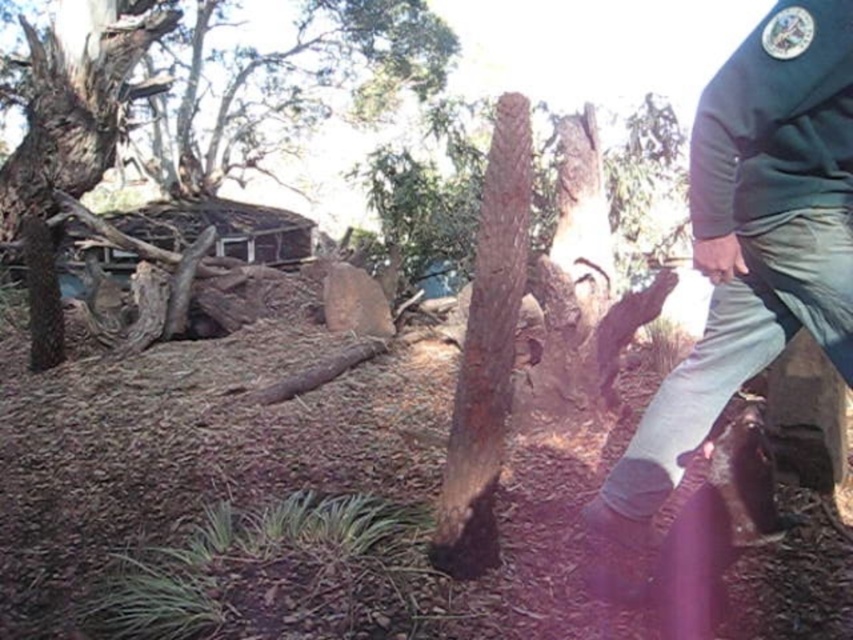
Which is below, dark green uniform at center or dark brown rough bark tree at left?

dark green uniform at center is lower down.

Can you confirm if dark green uniform at center is positioned below dark brown rough bark tree at left?

Correct, dark green uniform at center is located below dark brown rough bark tree at left.

Is point (776, 298) positioned in front of point (47, 172)?

Yes, point (776, 298) is in front of point (47, 172).

Where is `dark green uniform at center`? This screenshot has height=640, width=853. dark green uniform at center is located at coordinates (747, 253).

At what (x,y) coordinates should I click in order to perform the action: click on dark brown rough bark tree at left. Please return your answer as a coordinate pair (x, y). The height and width of the screenshot is (640, 853). Looking at the image, I should click on (71, 134).

Is dark brown rough bark tree at left in front of brown rough bark tree trunk at center?

No, dark brown rough bark tree at left is behind brown rough bark tree trunk at center.

Between point (120, 81) and point (459, 410), which one is positioned in front?

Point (459, 410) is in front.

Locate an element on the screen. The width and height of the screenshot is (853, 640). dark brown rough bark tree at left is located at coordinates (71, 134).

Which is below, dark green uniform at center or brown rough bark tree trunk at center?

dark green uniform at center

Who is positioned more to the right, dark green uniform at center or brown rough bark tree trunk at center?

dark green uniform at center

Is point (843, 285) behind point (502, 298)?

No, (843, 285) is closer to viewer.

This screenshot has width=853, height=640. In order to click on dark green uniform at center in this screenshot , I will do `click(747, 253)`.